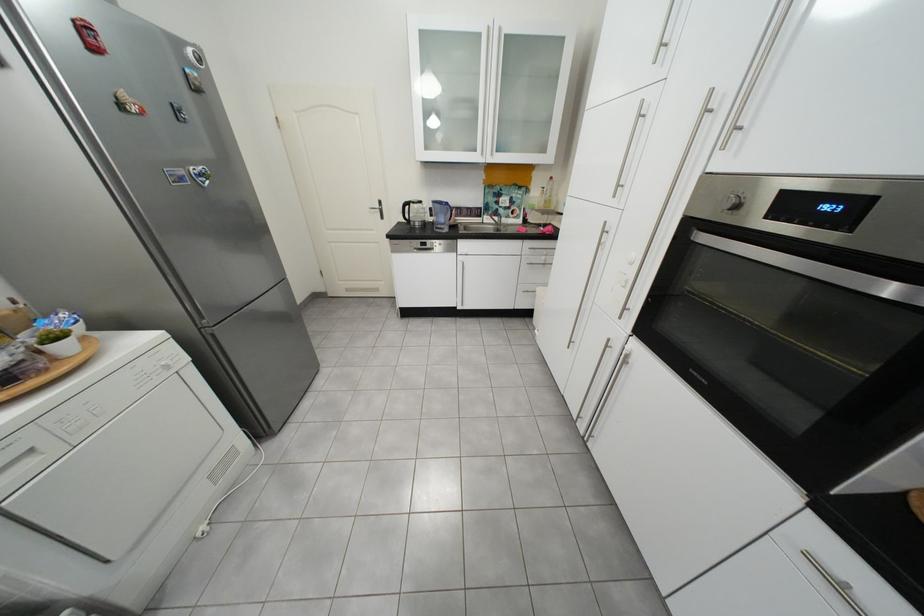
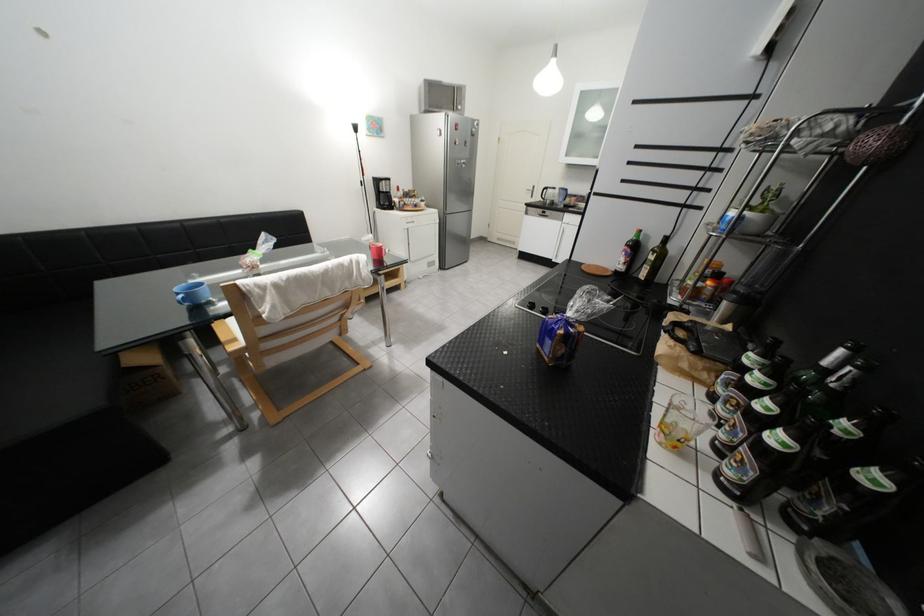
The point at (392, 204) is marked in the first image. Where is the corresponding point in the second image?

(545, 188)